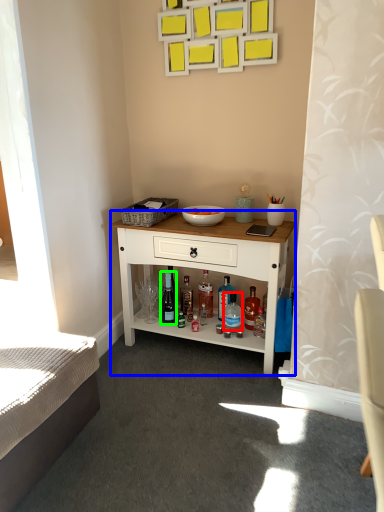
Question: Considering the real-world distances, which object is closest to bottle (highlighted by a red box)? desk (highlighted by a blue box) or wine bottle (highlighted by a green box).

Choices:
 (A) desk
 (B) wine bottle

Answer: (B)